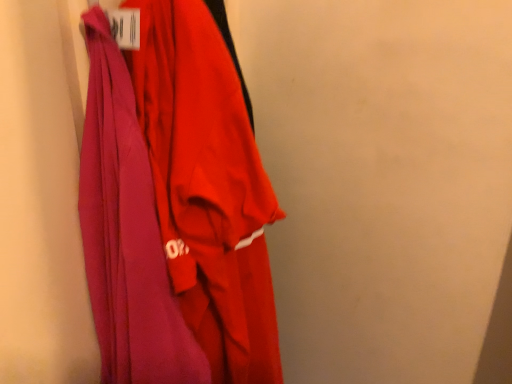
This screenshot has width=512, height=384. In order to click on pink fabric towel at left in this screenshot , I will do `click(175, 206)`.

This screenshot has width=512, height=384. What do you see at coordinates (175, 206) in the screenshot? I see `pink fabric towel at left` at bounding box center [175, 206].

What is the approximate width of pink fabric towel at left?

pink fabric towel at left is 9.41 inches in width.

Image resolution: width=512 pixels, height=384 pixels. Identify the location of pink fabric towel at left. (175, 206).